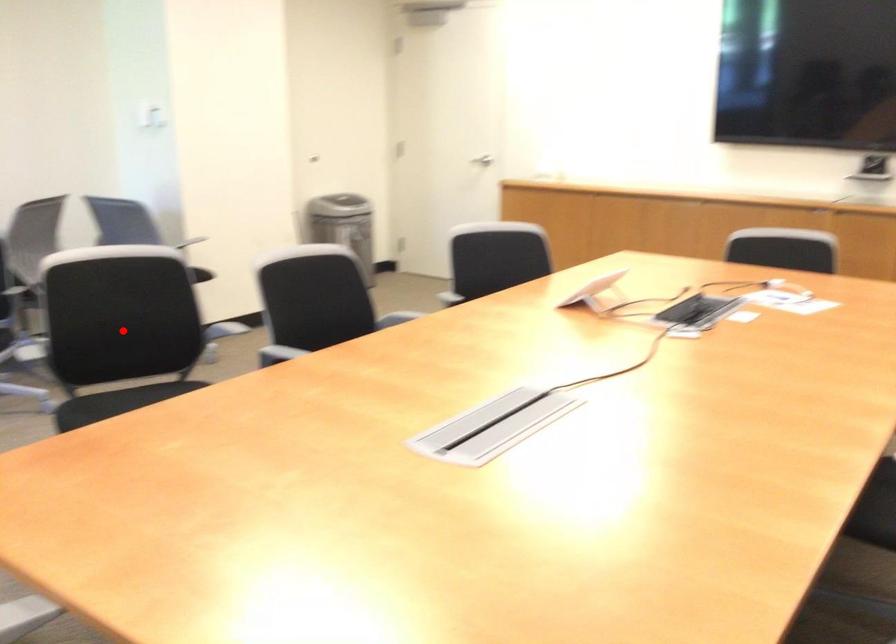
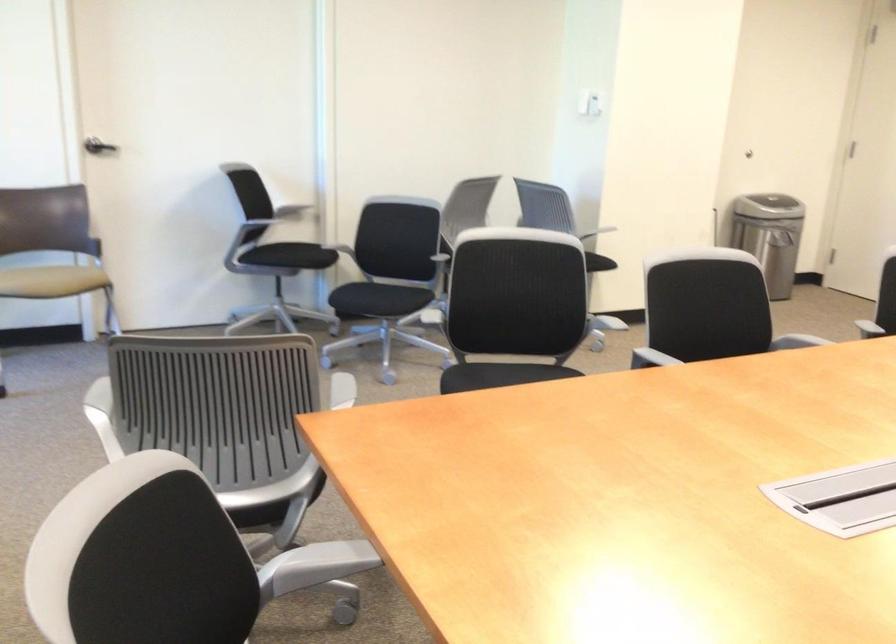
The point at the highlighted location is marked in the first image. Where is the corresponding point in the second image?

(513, 307)